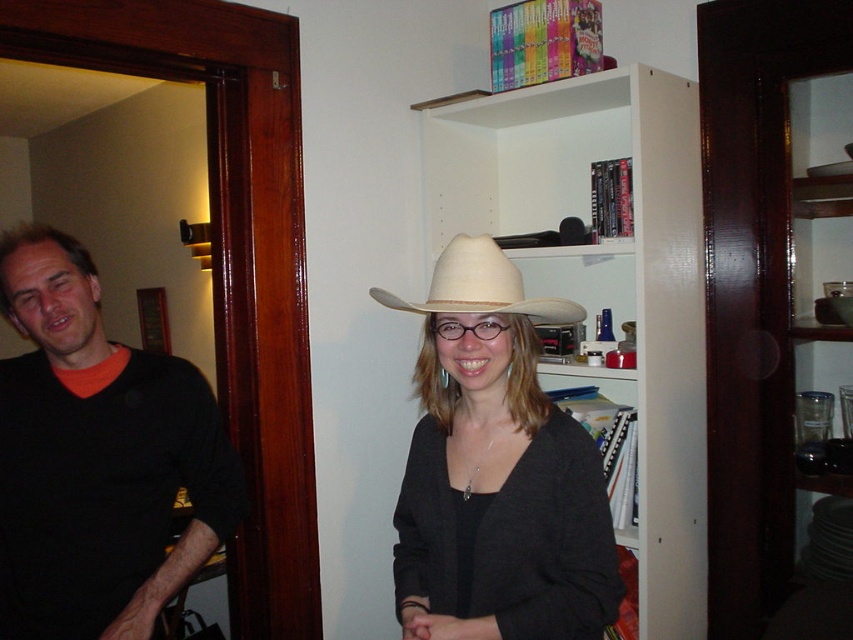
Question: Is black matte sweater at left to the left of white straw hat at center from the viewer's perspective?

Choices:
 (A) no
 (B) yes

Answer: (B)

Question: Based on their relative distances, which object is farther from the matte white cowboy hat at center?

Choices:
 (A) white straw hat at center
 (B) white matte bookshelf at upper center
 (C) black matte sweater at left

Answer: (B)

Question: In this image, where is white matte bookshelf at upper center located relative to black matte sweater at left?

Choices:
 (A) right
 (B) left

Answer: (A)

Question: Does black matte sweater at left have a larger size compared to matte white cowboy hat at center?

Choices:
 (A) yes
 (B) no

Answer: (A)

Question: Considering the real-world distances, which object is farthest from the black matte sweater at left?

Choices:
 (A) white matte bookshelf at upper center
 (B) white straw hat at center

Answer: (A)

Question: Which object is positioned closest to the matte white cowboy hat at center?

Choices:
 (A) white matte bookshelf at upper center
 (B) black matte sweater at left
 (C) white straw hat at center

Answer: (C)